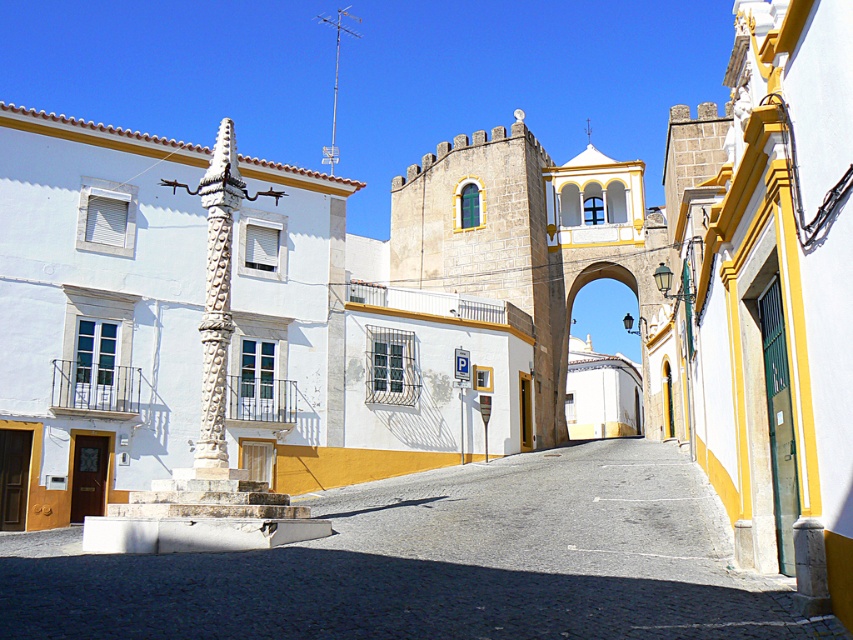
Question: Among these objects, which one is nearest to the camera?

Choices:
 (A) smooth stone alley at center
 (B) white stone column at center

Answer: (A)

Question: Does white stone column at center have a smaller size compared to white stone archway at center?

Choices:
 (A) no
 (B) yes

Answer: (B)

Question: Does smooth stone alley at center appear on the left side of white stone archway at center?

Choices:
 (A) no
 (B) yes

Answer: (B)

Question: Can you confirm if smooth stone alley at center is wider than white stone column at center?

Choices:
 (A) yes
 (B) no

Answer: (A)

Question: Based on their relative distances, which object is nearer to the white stone archway at center?

Choices:
 (A) white stone column at center
 (B) smooth stone alley at center

Answer: (B)

Question: Which object appears farthest from the camera in this image?

Choices:
 (A) smooth stone alley at center
 (B) white stone archway at center

Answer: (B)